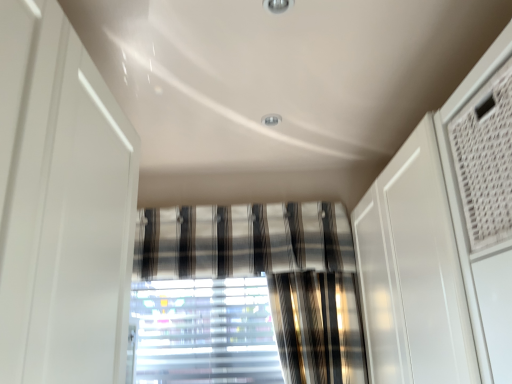
Question: Is striped fabric curtain at center wider than translucent plastic blinds at center?

Choices:
 (A) yes
 (B) no

Answer: (A)

Question: From a real-world perspective, does striped fabric curtain at center sit lower than translucent plastic blinds at center?

Choices:
 (A) no
 (B) yes

Answer: (A)

Question: From the image's perspective, would you say striped fabric curtain at center is positioned over translucent plastic blinds at center?

Choices:
 (A) no
 (B) yes

Answer: (B)

Question: Does striped fabric curtain at center come in front of translucent plastic blinds at center?

Choices:
 (A) yes
 (B) no

Answer: (A)

Question: Can you confirm if striped fabric curtain at center is smaller than translucent plastic blinds at center?

Choices:
 (A) yes
 (B) no

Answer: (B)

Question: Can you confirm if striped fabric curtain at center is taller than translucent plastic blinds at center?

Choices:
 (A) no
 (B) yes

Answer: (A)

Question: From the image's perspective, is translucent plastic blinds at center under striped fabric curtain at center?

Choices:
 (A) yes
 (B) no

Answer: (A)

Question: Does translucent plastic blinds at center have a greater width compared to striped fabric curtain at center?

Choices:
 (A) no
 (B) yes

Answer: (A)

Question: Is translucent plastic blinds at center far from striped fabric curtain at center?

Choices:
 (A) no
 (B) yes

Answer: (A)

Question: Is translucent plastic blinds at center aimed at striped fabric curtain at center?

Choices:
 (A) no
 (B) yes

Answer: (A)

Question: Can you confirm if translucent plastic blinds at center is positioned to the right of striped fabric curtain at center?

Choices:
 (A) yes
 (B) no

Answer: (B)

Question: From the image's perspective, is translucent plastic blinds at center over striped fabric curtain at center?

Choices:
 (A) yes
 (B) no

Answer: (B)

Question: Looking at their shapes, would you say translucent plastic blinds at center is wider or thinner than striped fabric curtain at center?

Choices:
 (A) wide
 (B) thin

Answer: (B)